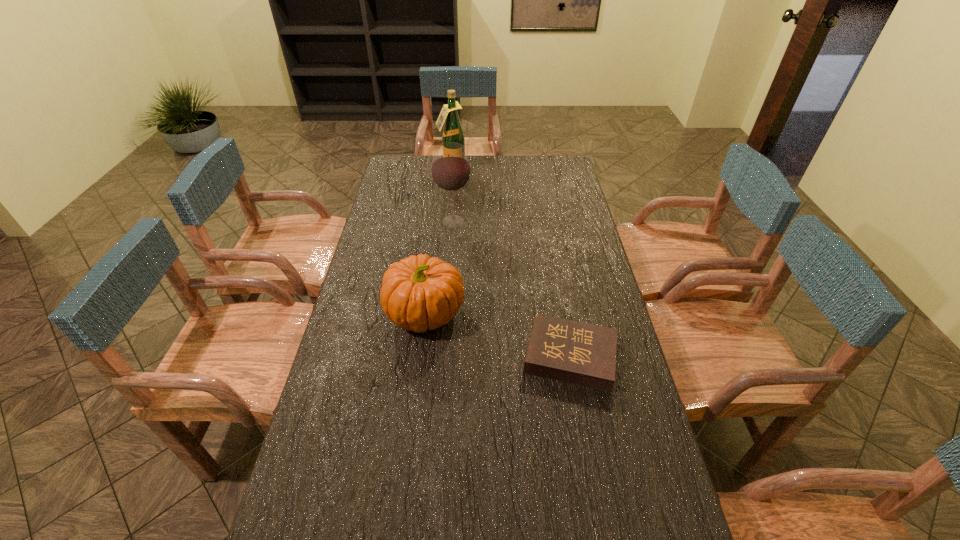
Where is `vacant region located 0.320m on the back of the rightmost object`? vacant region located 0.320m on the back of the rightmost object is located at coordinates (552, 259).

I want to click on object located at the far edge, so click(452, 132).

Identify the location of object present at the left edge. (418, 293).

Locate an element on the screen. object that is at the right edge is located at coordinates (574, 352).

The image size is (960, 540). What are the coordinates of `free region at the far edge of the desktop` in the screenshot? It's located at (528, 156).

Find the location of a particular element. free space at the right edge of the desktop is located at coordinates (584, 262).

Locate an element on the screen. The image size is (960, 540). vacant region at the far right corner of the desktop is located at coordinates (566, 156).

Identify the location of empty space between the pumpkin and the shortest object. The height and width of the screenshot is (540, 960). (498, 335).

I want to click on empty location between the third tallest object and the tallest object, so click(x=439, y=243).

The height and width of the screenshot is (540, 960). I want to click on free point between the third nearest object and the shortest object, so click(512, 289).